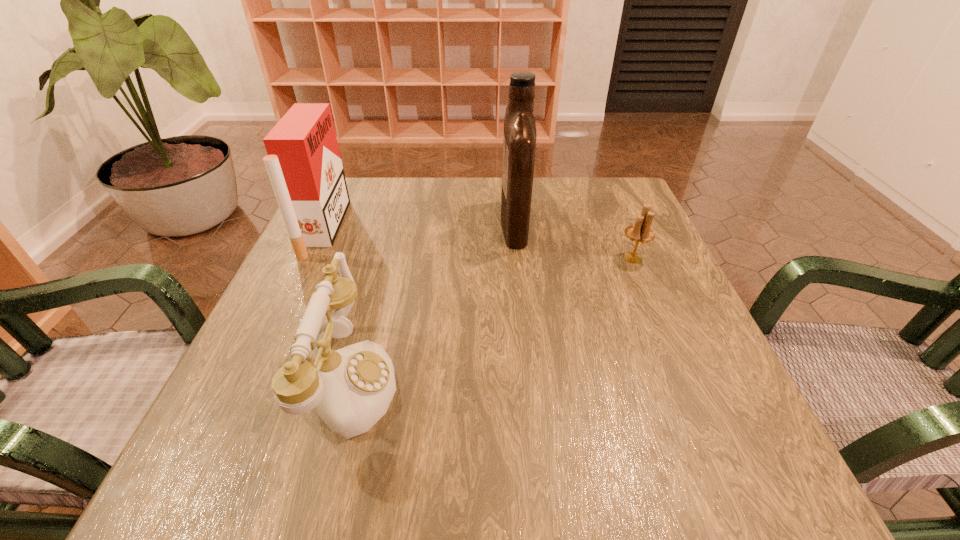
Find the location of `vacant space that's between the liquor and the leftmost object`. vacant space that's between the liquor and the leftmost object is located at coordinates (419, 226).

At what (x,y) coordinates should I click in order to perform the action: click on empty location between the telephone and the third object from left to right. Please return your answer as a coordinate pair (x, y). Looking at the image, I should click on (432, 302).

You are a GUI agent. You are given a task and a screenshot of the screen. Output one action in this format:
    pyautogui.click(x=<x>, y=<y>)
    Task: Click on the vacant region between the second object from right to left and the leftmost object
    The width and height of the screenshot is (960, 540).
    Given the screenshot: What is the action you would take?
    pyautogui.click(x=419, y=226)

Where is `vacant area between the liquor and the shortest object`? vacant area between the liquor and the shortest object is located at coordinates (574, 241).

Locate an element on the screen. This screenshot has height=540, width=960. free space between the liquor and the third shortest object is located at coordinates (419, 226).

This screenshot has height=540, width=960. In order to click on vacant area between the tallest object and the nearest object in this screenshot , I will do `click(432, 302)`.

Locate an element on the screen. The height and width of the screenshot is (540, 960). unoccupied position between the candle holder and the third object from right to left is located at coordinates (492, 320).

Locate which object is the second closest to the shortest object. Please provide its 2D coordinates. Your answer should be formatted as a tuple, i.e. [(x, y)], where the tuple contains the x and y coordinates of a point satisfying the conditions above.

[(352, 387)]

I want to click on object that is the third closest to the shortest object, so click(x=304, y=165).

Identify the location of free location that satisfies the following two spatial constraints: 1. on the label side of the liquor; 2. on the right side of the candle holder. This screenshot has height=540, width=960. (518, 258).